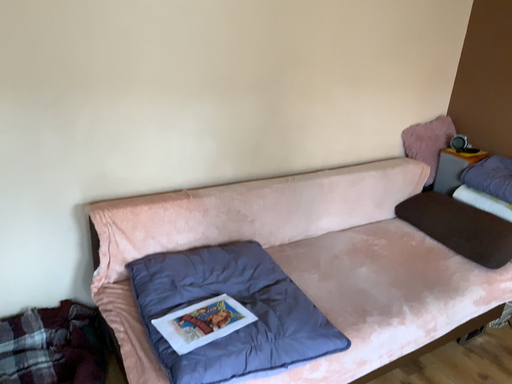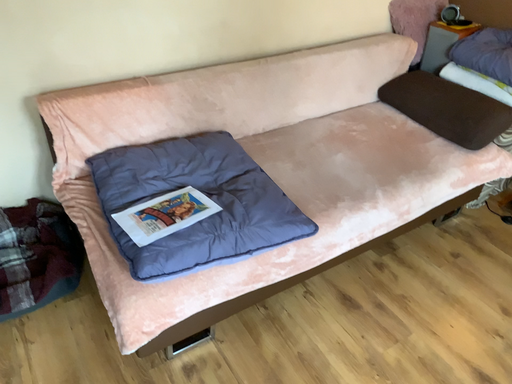
Question: How did the camera likely rotate when shooting the video?

Choices:
 (A) rotated downward
 (B) rotated upward

Answer: (A)